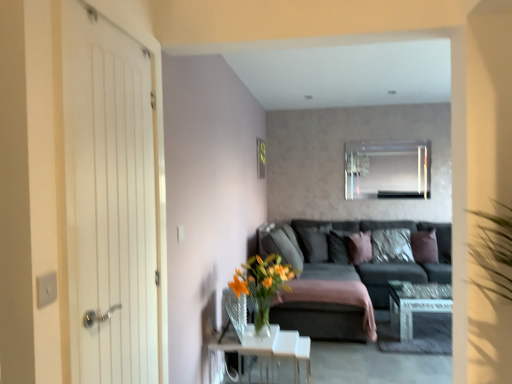
Image resolution: width=512 pixels, height=384 pixels. Identify the location of blank space situated above clear glass table at lower center, which is the first table in front-to-back order (from a real-world perspective). coord(237,332).